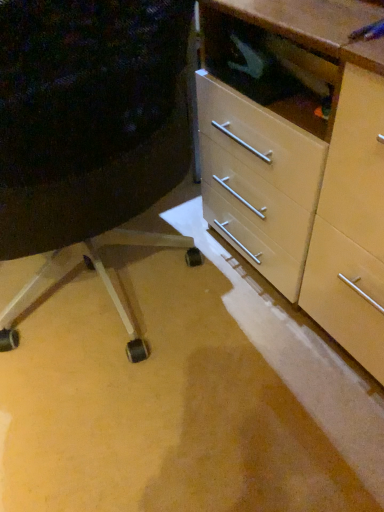
Question: Considering the positions of matte plastic drawer at center-right and matte wood chest of drawers at center in the image, is matte plastic drawer at center-right taller or shorter than matte wood chest of drawers at center?

Choices:
 (A) tall
 (B) short

Answer: (A)

Question: In the image, is matte plastic drawer at center-right positioned in front of or behind matte wood chest of drawers at center?

Choices:
 (A) front
 (B) behind

Answer: (A)

Question: Would you say matte plastic drawer at center-right is to the left or to the right of matte wood chest of drawers at center in the picture?

Choices:
 (A) right
 (B) left

Answer: (B)

Question: Is matte wood chest of drawers at center wider or thinner than matte plastic drawer at center-right?

Choices:
 (A) thin
 (B) wide

Answer: (A)

Question: Considering their positions, is matte wood chest of drawers at center located in front of or behind matte plastic drawer at center-right?

Choices:
 (A) front
 (B) behind

Answer: (B)

Question: Considering the positions of matte wood chest of drawers at center and matte plastic drawer at center-right in the image, is matte wood chest of drawers at center taller or shorter than matte plastic drawer at center-right?

Choices:
 (A) short
 (B) tall

Answer: (A)

Question: Based on their positions, is matte wood chest of drawers at center located to the left or right of matte plastic drawer at center-right?

Choices:
 (A) right
 (B) left

Answer: (A)